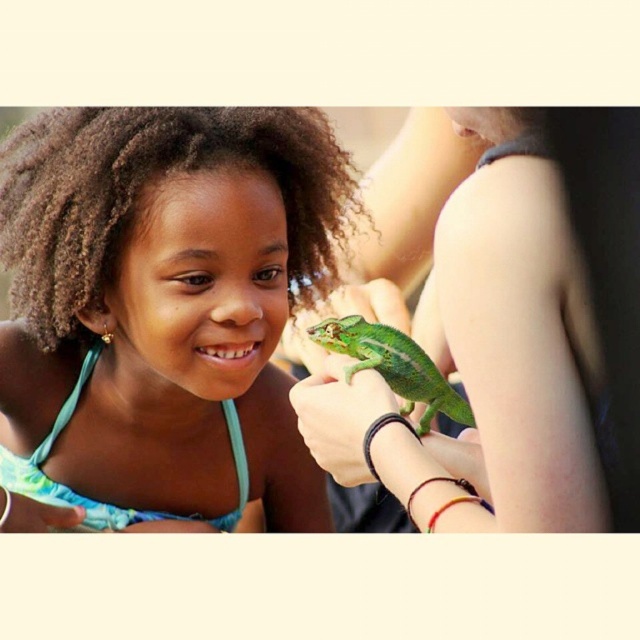
Question: Which of these objects is positioned farthest from the matte green chameleon at center?

Choices:
 (A) green matte chameleon at center
 (B) green scaly lizard at center

Answer: (A)

Question: Which object is closer to the camera taking this photo?

Choices:
 (A) matte green chameleon at center
 (B) green matte chameleon at center

Answer: (B)

Question: Is matte green chameleon at center to the left of green matte chameleon at center from the viewer's perspective?

Choices:
 (A) yes
 (B) no

Answer: (A)

Question: Can you confirm if matte green chameleon at center is wider than green matte chameleon at center?

Choices:
 (A) no
 (B) yes

Answer: (B)

Question: Can you confirm if matte green chameleon at center is positioned to the right of green matte chameleon at center?

Choices:
 (A) yes
 (B) no

Answer: (B)

Question: Which of the following is the closest to the observer?

Choices:
 (A) green matte chameleon at center
 (B) matte green chameleon at center
 (C) green scaly lizard at center

Answer: (A)